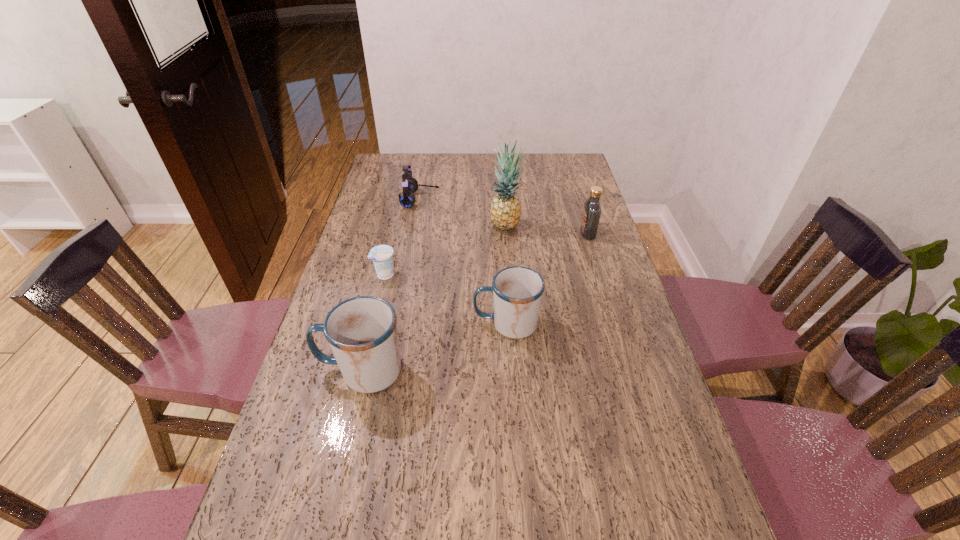
Identify the location of free spot between the farther mug and the left mug. The height and width of the screenshot is (540, 960). (434, 347).

The height and width of the screenshot is (540, 960). Find the location of `object that is the second nearest to the taller mug`. object that is the second nearest to the taller mug is located at coordinates (382, 255).

Point out which object is positioned as the nearest to the pineapple. Please provide its 2D coordinates. Your answer should be formatted as a tuple, i.e. [(x, y)], where the tuple contains the x and y coordinates of a point satisfying the conditions above.

[(410, 185)]

The width and height of the screenshot is (960, 540). In order to click on vacant region that satisfies the following two spatial constraints: 1. on the ear cushions of the headset; 2. on the left side of the pineapple in this screenshot , I will do `click(416, 225)`.

Find the location of a particular element. This screenshot has width=960, height=540. blank area in the image that satisfies the following two spatial constraints: 1. on the front side of the fourth farthest object; 2. on the handle side of the nearer mug is located at coordinates (362, 371).

Locate an element on the screen. The height and width of the screenshot is (540, 960). vacant position in the image that satisfies the following two spatial constraints: 1. on the front side of the shortest object; 2. on the handle side of the left mug is located at coordinates (362, 371).

In order to click on free region that satisfies the following two spatial constraints: 1. on the front side of the yogurt; 2. on the handle side of the taller mug in this screenshot , I will do `click(362, 371)`.